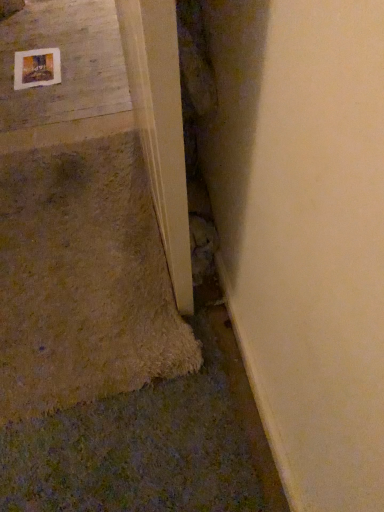
Identify the location of wooden frame at upper left. The image size is (384, 512). (37, 68).

Find the location of a particular element. smooth concrete at upper left is located at coordinates (64, 63).

Locate an element on the screen. wooden frame at upper left is located at coordinates (37, 68).

Would you say light wood door frame at lower left is a long distance from smooth concrete at upper left?

light wood door frame at lower left is far away from smooth concrete at upper left.

Who is taller, light wood door frame at lower left or smooth concrete at upper left?

Standing taller between the two is light wood door frame at lower left.

Is point (169, 56) positioned after point (89, 108)?

No, it is in front of (89, 108).

Consider the image. Could you tell me if light wood door frame at lower left is facing smooth concrete at upper left?

No, light wood door frame at lower left is not aimed at smooth concrete at upper left.

Does wooden frame at upper left appear on the left side of light wood door frame at lower left?

Yes.

From a real-world perspective, between wooden frame at upper left and light wood door frame at lower left, who is vertically higher?

light wood door frame at lower left, from a real-world perspective.

You are a GUI agent. You are given a task and a screenshot of the screen. Output one action in this format:
    pyautogui.click(x=<x>, y=<y>)
    Task: Click on the beam lying on the right of wooden frame at upper left
    Image resolution: width=384 pixels, height=512 pixels.
    Given the screenshot: What is the action you would take?
    pyautogui.click(x=160, y=127)

Considering the positions of objects wooden frame at upper left and light wood door frame at lower left in the image provided, who is in front, wooden frame at upper left or light wood door frame at lower left?

light wood door frame at lower left is more forward.

Based on their sizes in the image, would you say wooden frame at upper left is bigger or smaller than smooth concrete at upper left?

Considering their sizes, wooden frame at upper left takes up less space than smooth concrete at upper left.

Is wooden frame at upper left positioned beyond the bounds of smooth concrete at upper left?

No, wooden frame at upper left is inside or overlapping with smooth concrete at upper left.

Can you confirm if wooden frame at upper left is positioned to the left of smooth concrete at upper left?

Yes.

Considering the sizes of objects wooden frame at upper left and smooth concrete at upper left in the image provided, who is shorter, wooden frame at upper left or smooth concrete at upper left?

With less height is wooden frame at upper left.

Is smooth concrete at upper left not near wooden frame at upper left?

No, there isn't a large distance between smooth concrete at upper left and wooden frame at upper left.

Between smooth concrete at upper left and wooden frame at upper left, which one has more height?

With more height is smooth concrete at upper left.

Does smooth concrete at upper left turn towards wooden frame at upper left?

No, smooth concrete at upper left does not turn towards wooden frame at upper left.

Identify the location of concrete in front of the wooden frame at upper left. This screenshot has height=512, width=384. (64, 63).

Is light wood door frame at lower left next to wooden frame at upper left and touching it?

No, light wood door frame at lower left is not with wooden frame at upper left.

How different are the orientations of light wood door frame at lower left and wooden frame at upper left in degrees?

The angular difference between light wood door frame at lower left and wooden frame at upper left is 89.8 degrees.

Does light wood door frame at lower left lie in front of wooden frame at upper left?

That is True.

How far apart are light wood door frame at lower left and wooden frame at upper left?

light wood door frame at lower left is 3.93 feet away from wooden frame at upper left.

From a real-world perspective, is smooth concrete at upper left beneath light wood door frame at lower left?

Yes, from a real-world perspective, smooth concrete at upper left is below light wood door frame at lower left.

Does smooth concrete at upper left have a greater width compared to light wood door frame at lower left?

Correct, the width of smooth concrete at upper left exceeds that of light wood door frame at lower left.

Is smooth concrete at upper left smaller than light wood door frame at lower left?

Yes, smooth concrete at upper left is smaller than light wood door frame at lower left.

Considering the positions of objects smooth concrete at upper left and light wood door frame at lower left in the image provided, who is more to the right, smooth concrete at upper left or light wood door frame at lower left?

light wood door frame at lower left is more to the right.

Identify the location of concrete that appears below the light wood door frame at lower left (from a real-world perspective). (64, 63).

You are a GUI agent. You are given a task and a screenshot of the screen. Output one action in this format:
    pyautogui.click(x=<x>, y=<y>)
    Task: Click on the picture frame that is on the left side of light wood door frame at lower left
    
    Given the screenshot: What is the action you would take?
    pyautogui.click(x=37, y=68)

Based on their spatial positions, is wooden frame at upper left or light wood door frame at lower left further from smooth concrete at upper left?

light wood door frame at lower left is further to smooth concrete at upper left.

In the scene shown: Which object lies further to the anchor point wooden frame at upper left, smooth concrete at upper left or light wood door frame at lower left?

The object further to wooden frame at upper left is light wood door frame at lower left.

Estimate the real-world distances between objects in this image. Which object is further from smooth concrete at upper left, light wood door frame at lower left or wooden frame at upper left?

Based on the image, light wood door frame at lower left appears to be further to smooth concrete at upper left.

When comparing their distances from wooden frame at upper left, does light wood door frame at lower left or smooth concrete at upper left seem closer?

Among the two, smooth concrete at upper left is located nearer to wooden frame at upper left.

Looking at the image, which one is located further to light wood door frame at lower left, smooth concrete at upper left or wooden frame at upper left?

wooden frame at upper left.

From the image, which object appears to be farther from light wood door frame at lower left, wooden frame at upper left or smooth concrete at upper left?

wooden frame at upper left is positioned further to the anchor light wood door frame at lower left.

Locate an element on the screen. concrete between light wood door frame at lower left and wooden frame at upper left in the front-back direction is located at coordinates (64, 63).